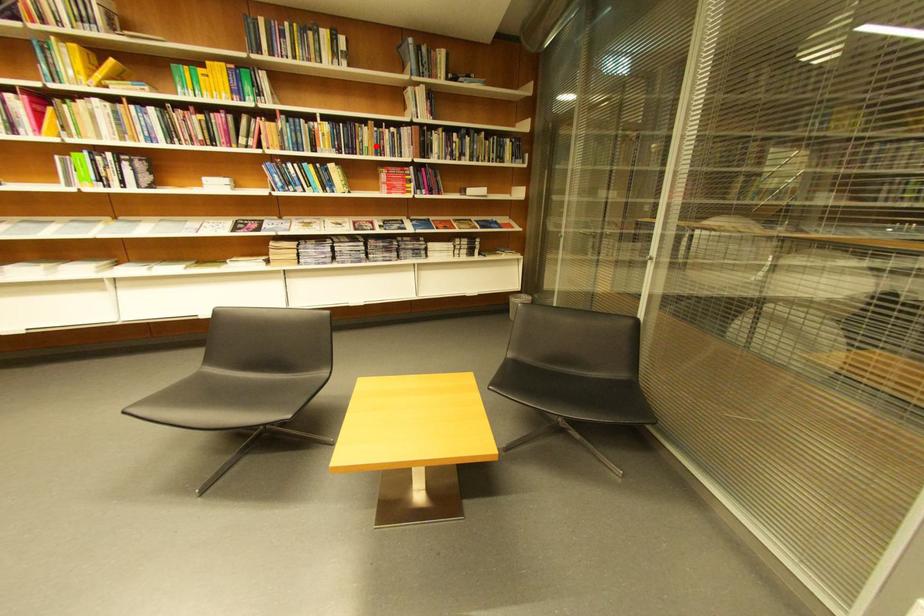
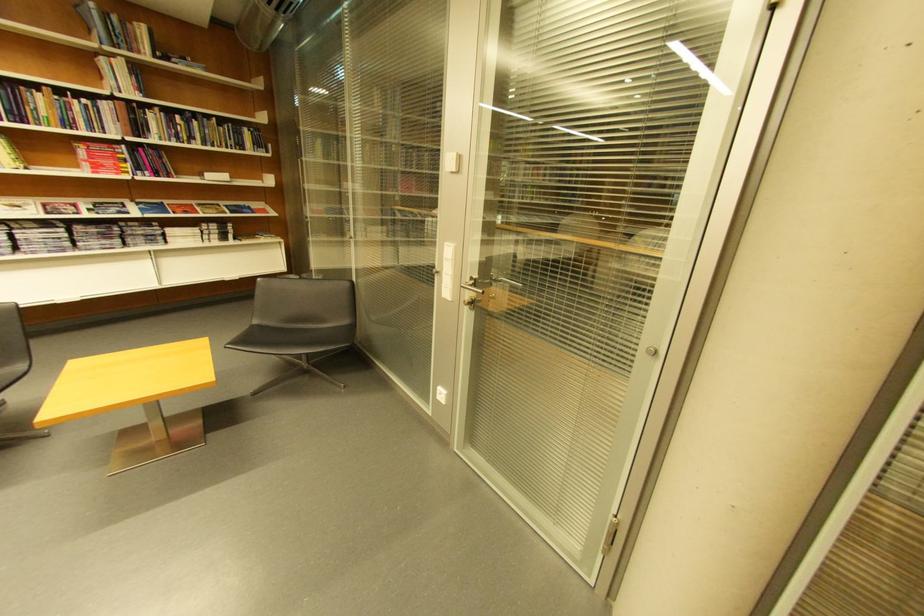
Where in the second image is the point corresponding to the highlighted location from the first image?

(54, 116)